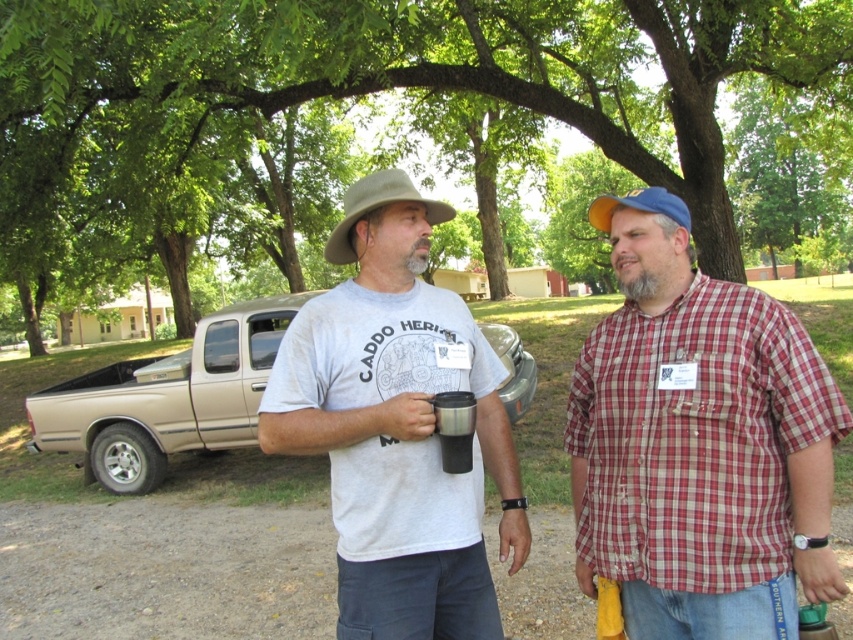
You are a photographer planning to take a photo of the two men under the tree. The green leafy tree at upper center is located at point (399,76). Where should you position your camera to ensure the tree is centered in the frame?

To center the green leafy tree at upper center in the frame, position the camera at point (399,76).